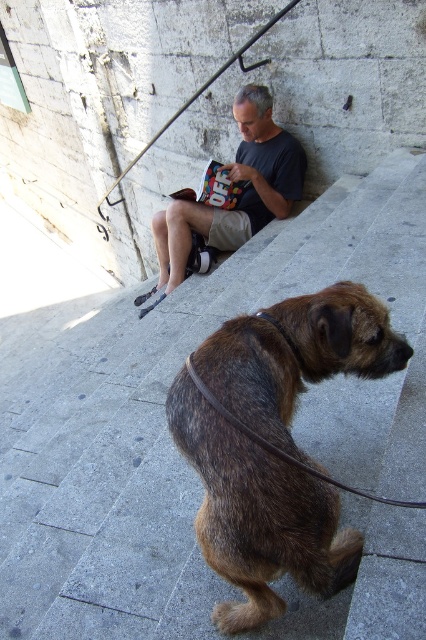
You are a dog trainer observing the scene. You notice a brown shaggy dog at lower center and a brown leather leash at lower center. Which object is wider?

The brown shaggy dog at lower center is wider than the brown leather leash at lower center.

You are standing at the base of the stone steps and want to walk towards the man reading the book. Which point, point [256,163] or point [227,419], is closer to you as you approach the steps?

Point [256,163] is closer to you because it is further to the viewer than point [227,419], meaning it is physically nearer in the scene.